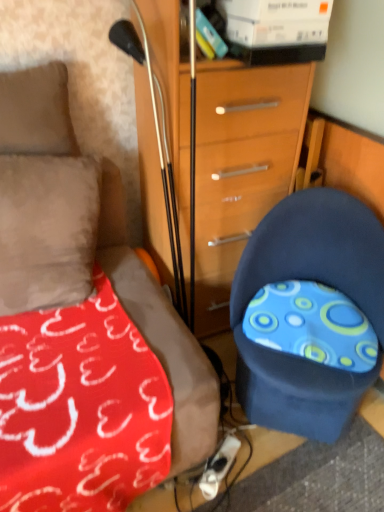
Question: Does wooden chest of drawers at center have a smaller size compared to suede-like beige pillow at upper left?

Choices:
 (A) no
 (B) yes

Answer: (A)

Question: Does wooden chest of drawers at center have a lesser height compared to suede-like beige pillow at upper left?

Choices:
 (A) no
 (B) yes

Answer: (A)

Question: Does wooden chest of drawers at center have a greater height compared to suede-like beige pillow at upper left?

Choices:
 (A) no
 (B) yes

Answer: (B)

Question: Considering the relative positions of wooden chest of drawers at center and suede-like beige pillow at upper left in the image provided, is wooden chest of drawers at center to the left of suede-like beige pillow at upper left from the viewer's perspective?

Choices:
 (A) no
 (B) yes

Answer: (A)

Question: Is wooden chest of drawers at center thinner than suede-like beige pillow at upper left?

Choices:
 (A) no
 (B) yes

Answer: (A)

Question: Is wooden chest of drawers at center at the right side of suede-like beige pillow at upper left?

Choices:
 (A) no
 (B) yes

Answer: (B)

Question: From the image's perspective, is blue fabric chair at lower right above suede-like beige pillow at upper left?

Choices:
 (A) yes
 (B) no

Answer: (B)

Question: Does blue fabric chair at lower right have a smaller size compared to suede-like beige pillow at upper left?

Choices:
 (A) yes
 (B) no

Answer: (B)

Question: Does blue fabric chair at lower right have a larger size compared to suede-like beige pillow at upper left?

Choices:
 (A) yes
 (B) no

Answer: (A)

Question: Can you confirm if blue fabric chair at lower right is positioned to the left of suede-like beige pillow at upper left?

Choices:
 (A) no
 (B) yes

Answer: (A)

Question: From a real-world perspective, is blue fabric chair at lower right over suede-like beige pillow at upper left?

Choices:
 (A) no
 (B) yes

Answer: (A)

Question: Would you say blue fabric chair at lower right is a long distance from suede-like beige pillow at upper left?

Choices:
 (A) no
 (B) yes

Answer: (A)

Question: Are wooden chest of drawers at center and blue fabric chair at lower right far apart?

Choices:
 (A) yes
 (B) no

Answer: (B)